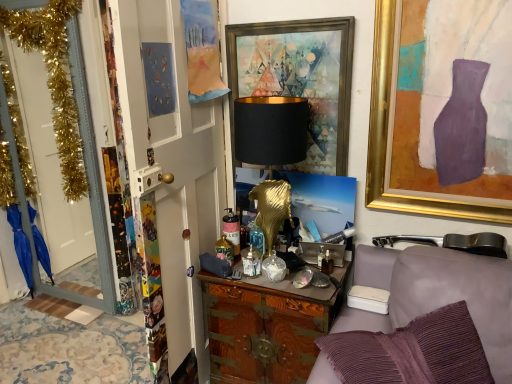
Question: Is white fabric armchair at lower right to the left or to the right of wooden cabinet at center in the image?

Choices:
 (A) right
 (B) left

Answer: (A)

Question: Is white fabric armchair at lower right wider or thinner than wooden cabinet at center?

Choices:
 (A) thin
 (B) wide

Answer: (A)

Question: Based on their relative distances, which object is farther from the black matte/golden base at center?

Choices:
 (A) white glossy door at left, acting as the 1th door starting from the left
 (B) white painted wood door at left, which ranks as the 1th door in front-to-back order
 (C) wooden cabinet at center
 (D) gold-framed painting at upper right, which is the 1th picture frame from right to left
 (E) metallic gold picture frame at upper center, arranged as the second picture frame when viewed from the right

Answer: (A)

Question: Considering the real-world distances, which object is closest to the white painted wood door at left, which is the first door in right-to-left order?

Choices:
 (A) black matte/golden base at center
 (B) white fabric armchair at lower right
 (C) metallic gold picture frame at upper center, which appears as the 1th picture frame when viewed from the left
 (D) white glossy door at left, acting as the 1th door starting from the left
 (E) gold-framed painting at upper right, which is the 1th picture frame from right to left

Answer: (A)